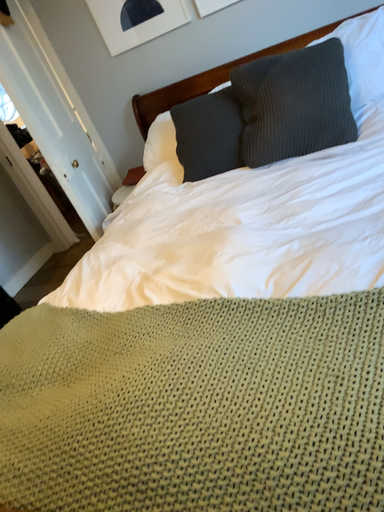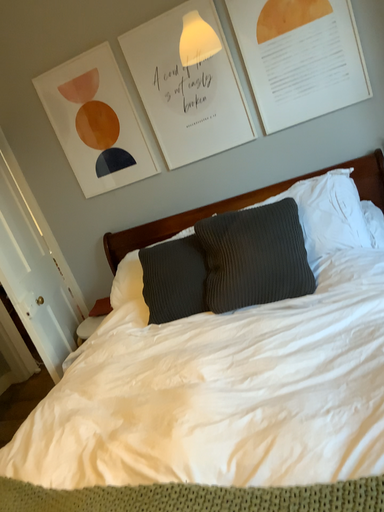
Question: How did the camera likely rotate when shooting the video?

Choices:
 (A) rotated downward
 (B) rotated upward

Answer: (B)